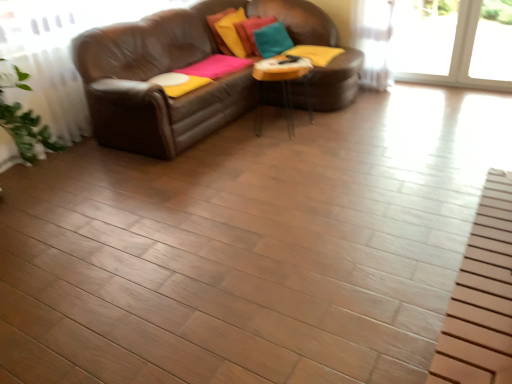
Question: Looking at the image, does velvet teal pillow at upper center, the 2th pillow in the left-to-right sequence, seem bigger or smaller compared to clear glass table at center?

Choices:
 (A) small
 (B) big

Answer: (A)

Question: Is velvet teal pillow at upper center, the 2th pillow in the left-to-right sequence, to the left or to the right of clear glass table at center in the image?

Choices:
 (A) left
 (B) right

Answer: (A)

Question: Based on their relative distances, which object is farther from the velvet yellow pillow at upper center, placed as the third pillow when sorted from right to left?

Choices:
 (A) velvet teal pillow at upper center, marked as the 2th pillow in a right-to-left arrangement
 (B) clear glass table at center
 (C) teal fabric pillow at upper center, the 3th pillow when ordered from left to right

Answer: (B)

Question: Which is nearer to the velvet teal pillow at upper center, marked as the 2th pillow in a right-to-left arrangement?

Choices:
 (A) clear glass table at center
 (B) velvet yellow pillow at upper center, placed as the third pillow when sorted from right to left
 (C) teal fabric pillow at upper center, which is counted as the 1th pillow, starting from the right

Answer: (B)